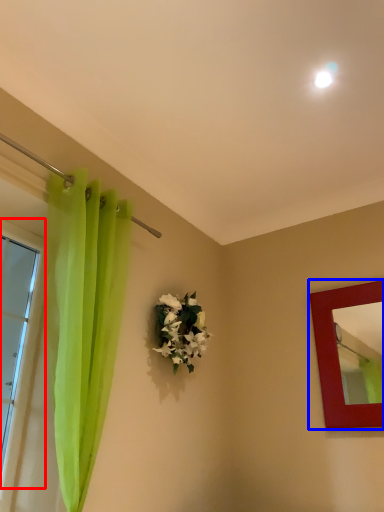
Question: Which object is further to the camera taking this photo, window (highlighted by a red box) or picture frame (highlighted by a blue box)?

Choices:
 (A) window
 (B) picture frame

Answer: (B)